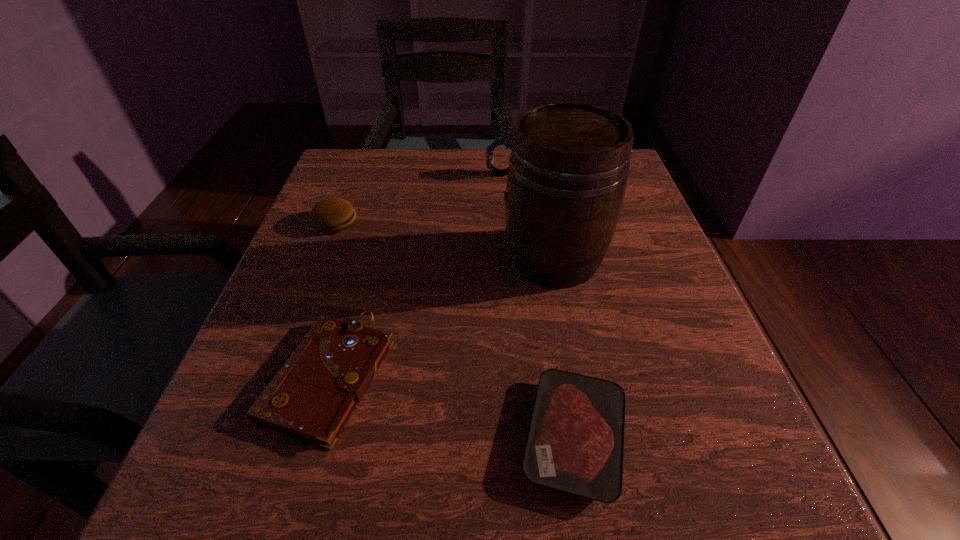
Image resolution: width=960 pixels, height=540 pixels. Find the location of `cider`. cider is located at coordinates (569, 164).

Image resolution: width=960 pixels, height=540 pixels. Find the location of `watch`. watch is located at coordinates pos(500,141).

In order to click on the fourth shortest object in this screenshot , I will do `click(500, 141)`.

Locate an element on the screen. patty is located at coordinates (x=333, y=215).

Where is `notebook`? notebook is located at coordinates (313, 395).

I want to click on steak, so click(x=575, y=444).

In order to click on vacant region located 0.180m on the side of the tallest object near the bung hole in this screenshot , I will do `click(408, 258)`.

Identify the location of vacant space situated on the side of the tallest object near the bung hole. The height and width of the screenshot is (540, 960). (336, 258).

Locate an element on the screen. free point located 0.360m on the side of the tallest object near the bung hole is located at coordinates click(315, 258).

I want to click on vacant region located on the face of the watch, so click(x=404, y=174).